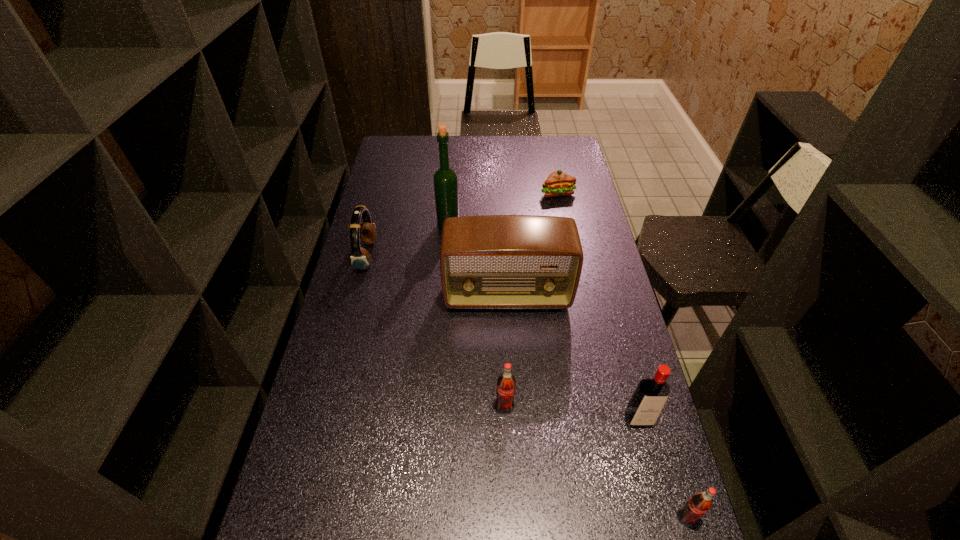
Find the location of `the left soda bottle`. the left soda bottle is located at coordinates (506, 384).

Find the location of `the taller soda bottle`. the taller soda bottle is located at coordinates (506, 384).

The height and width of the screenshot is (540, 960). In order to click on the nearer soda bottle in this screenshot , I will do `click(696, 506)`.

The width and height of the screenshot is (960, 540). What are the coordinates of `the right soda bottle` in the screenshot? It's located at (696, 506).

Image resolution: width=960 pixels, height=540 pixels. What are the coordinates of `the fourth nearest object` in the screenshot? It's located at (491, 261).

Identify the location of the tallest object. (445, 179).

You are a GUI agent. You are given a task and a screenshot of the screen. Output one action in this format:
    pyautogui.click(x=<x>, y=<y>)
    Task: Click on the liquor
    Image resolution: width=960 pixels, height=540 pixels.
    Given the screenshot: What is the action you would take?
    pyautogui.click(x=445, y=179)

Find the location of a particular element. The height and width of the screenshot is (540, 960). the shortest object is located at coordinates (558, 183).

The image size is (960, 540). I want to click on sandwich, so click(558, 183).

What are the coordinates of `the leftmost object` in the screenshot? It's located at (360, 258).